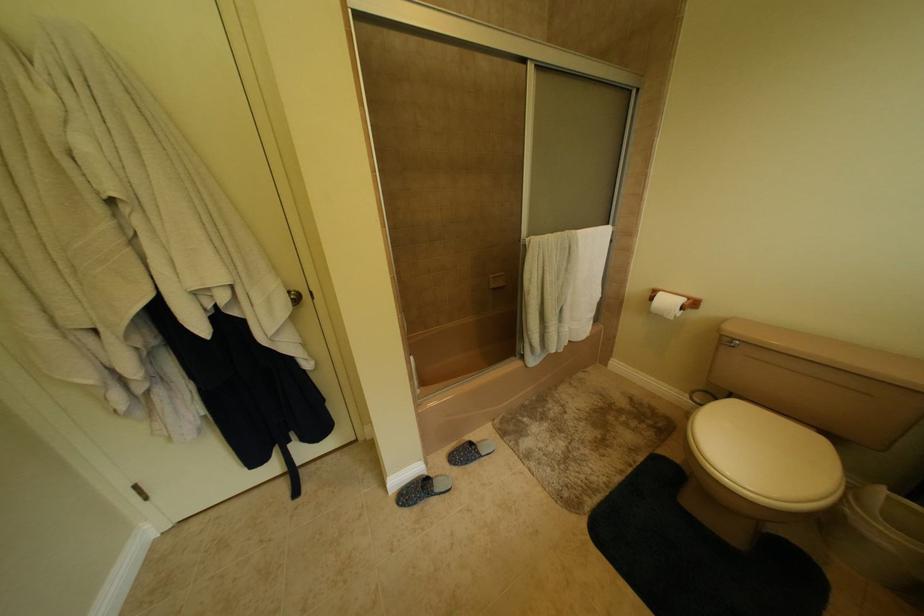
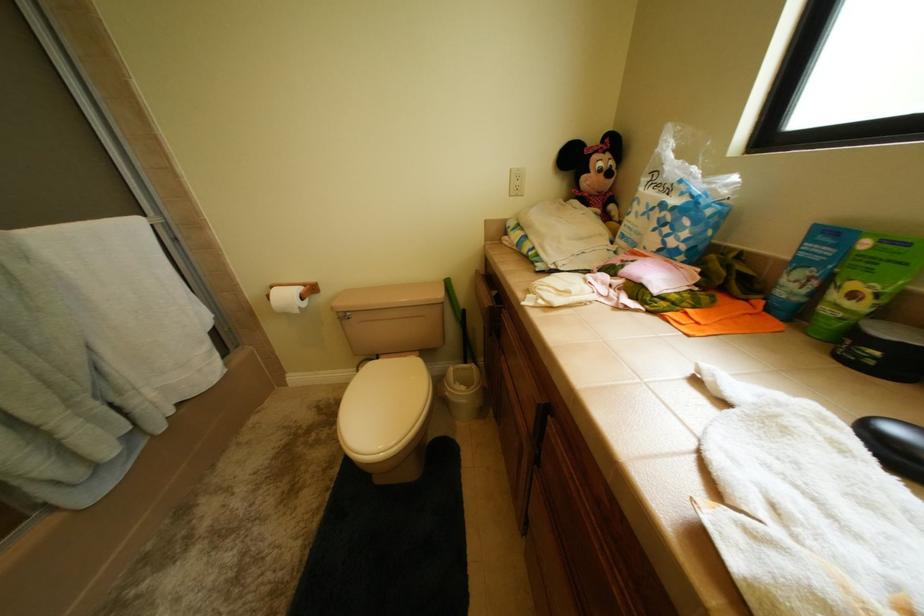
Question: How did the camera likely rotate?

Choices:
 (A) Left
 (B) Right
 (C) Up
 (D) Down

Answer: (B)